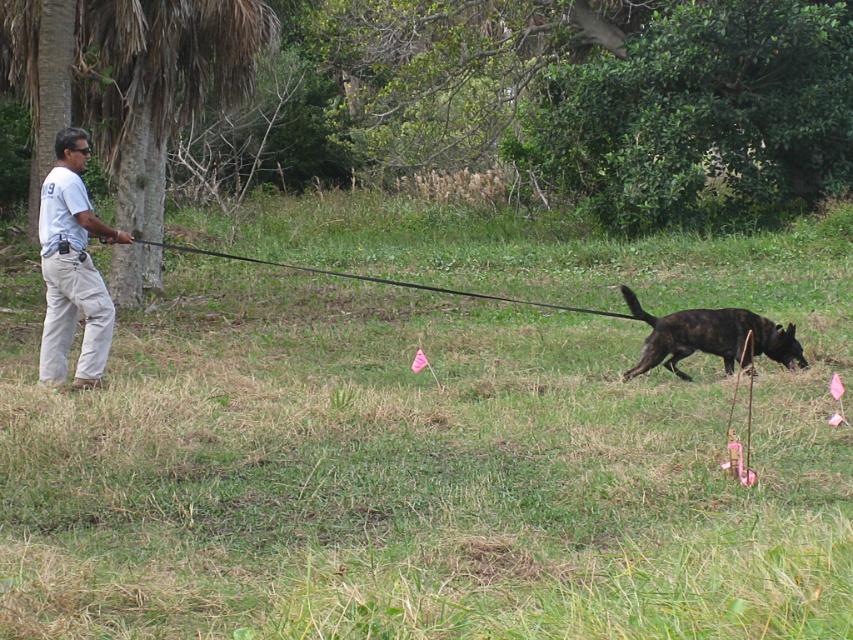
Measure the distance between point [73,195] and camera.

They are 28.72 feet apart.

Does white cotton shirt at left come in front of black rubber leash at left?

That is True.

Describe the element at coordinates (73, 268) in the screenshot. I see `white cotton shirt at left` at that location.

Locate an element on the screen. white cotton shirt at left is located at coordinates (73, 268).

Between green grassy at center and black rubber leash at left, which one appears on the left side from the viewer's perspective?

From the viewer's perspective, black rubber leash at left appears more on the left side.

How far apart are green grassy at center and black rubber leash at left?

A distance of 1.96 meters exists between green grassy at center and black rubber leash at left.

Which is in front, point (196, 323) or point (567, 308)?

Positioned in front is point (196, 323).

Where is `green grassy at center`? This screenshot has width=853, height=640. green grassy at center is located at coordinates (431, 442).

Who is more forward, (161, 620) or (691, 349)?

Point (161, 620)

What do you see at coordinates (431, 442) in the screenshot? I see `green grassy at center` at bounding box center [431, 442].

This screenshot has height=640, width=853. Identify the location of green grassy at center. (431, 442).